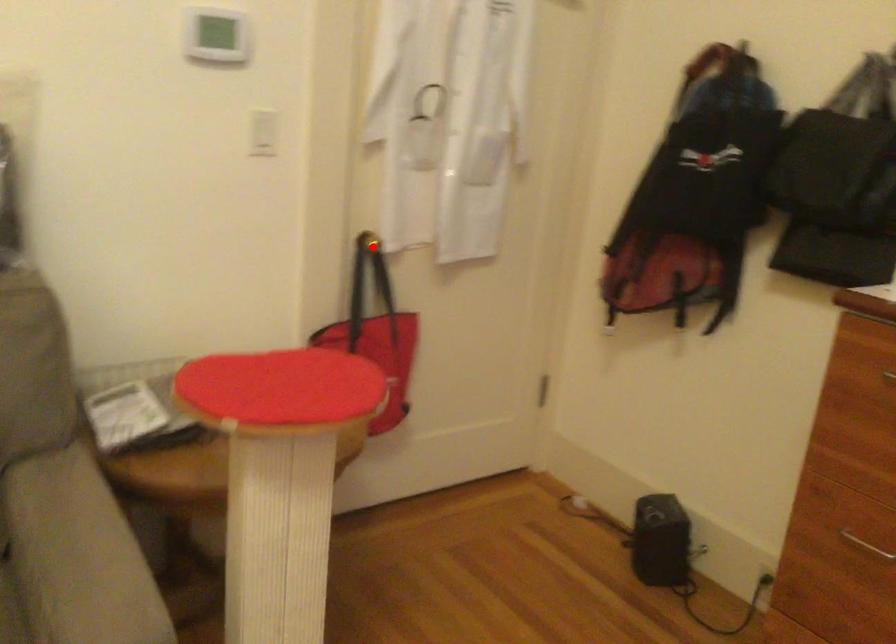
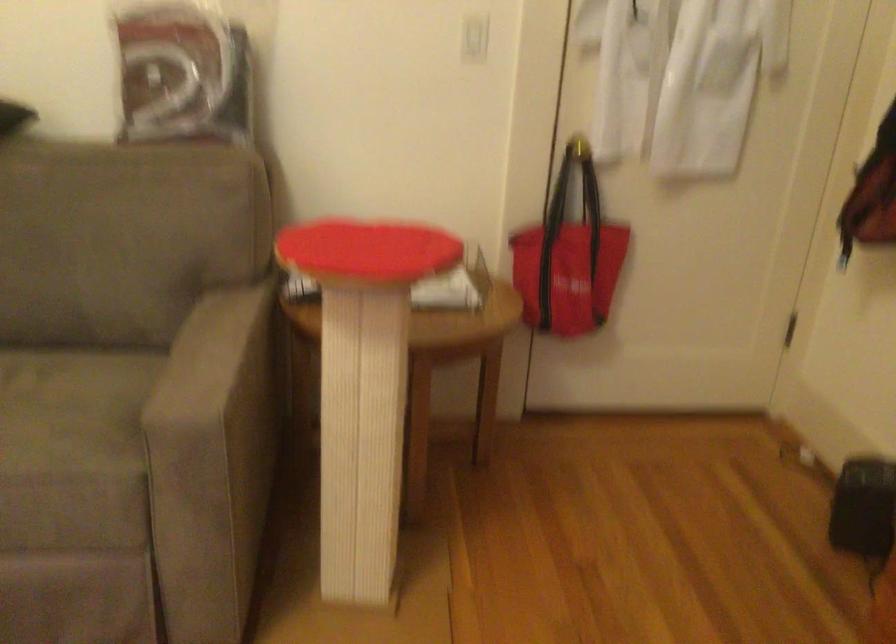
The point at the highlighted location is marked in the first image. Where is the corresponding point in the second image?

(579, 147)